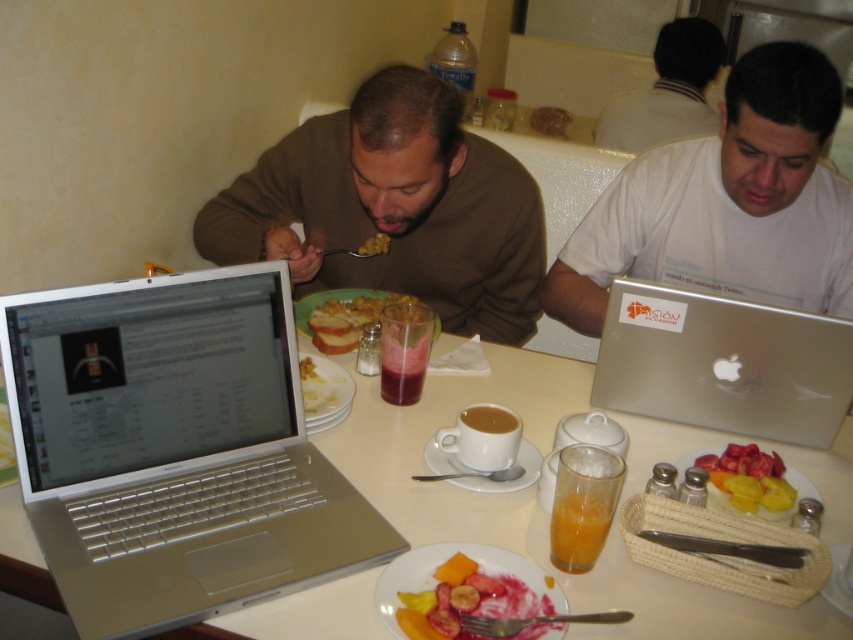
You are a waiter in a cafe and need to place a new order of pancakes on the table. The pancakes are too hot to touch, so you must set them down without moving any existing items. Can you safely place the pancakes between the silver metallic laptop at center and the translucent glass of orange juice at center?

The silver metallic laptop at center is closer to the viewer than the translucent glass of orange juice at center, so there is space between them to place the pancakes without moving any items.

In the scene shown: You are a waiter in a cafe and you see the silver metallic laptop at center and the translucent glass of orange juice at center on the table. Which item is closer to the left edge of the table?

The silver metallic laptop at center is positioned on the left side of the translucent glass of orange juice at center, so it is closer to the left edge of the table.